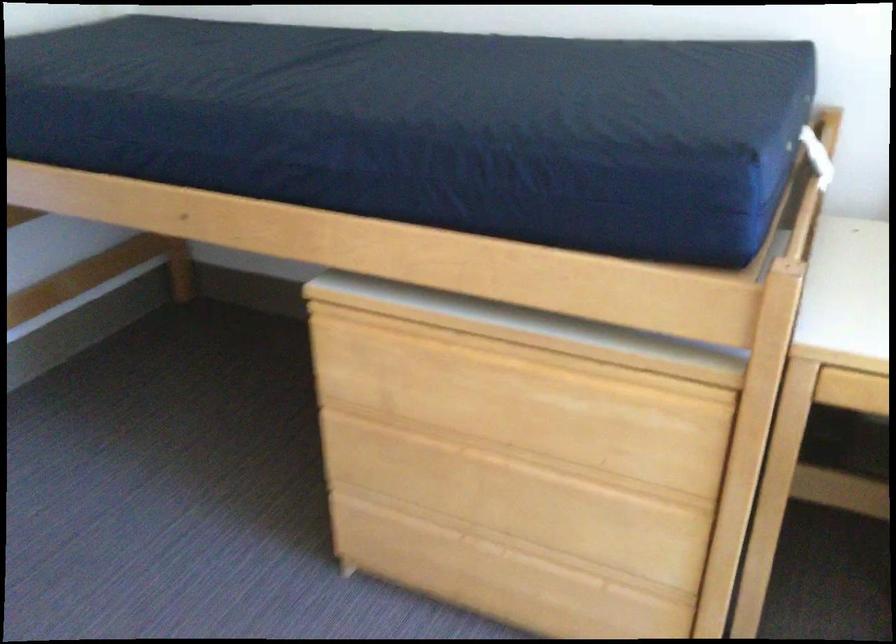
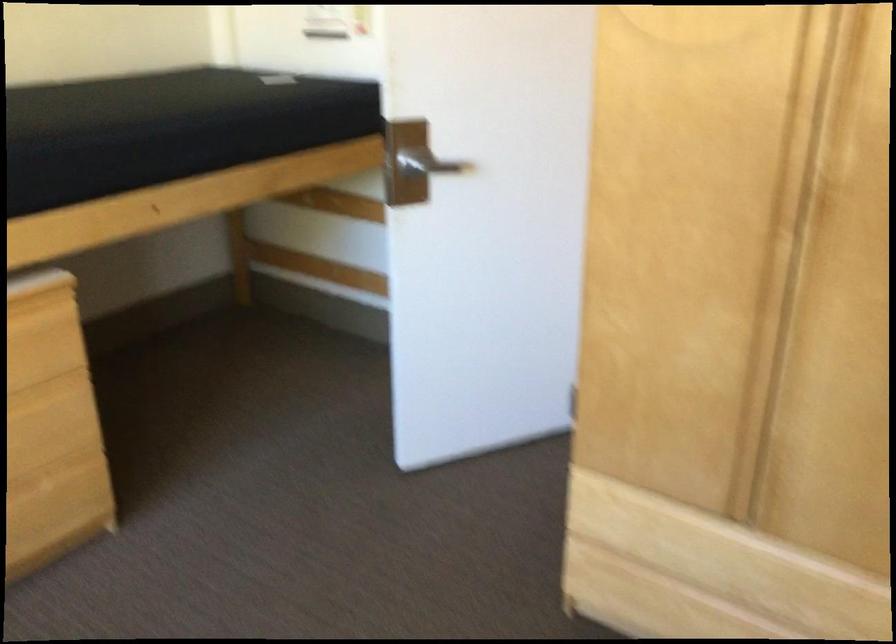
Looking at this image, how did the camera likely rotate?

The rotation direction of the camera is left-down.